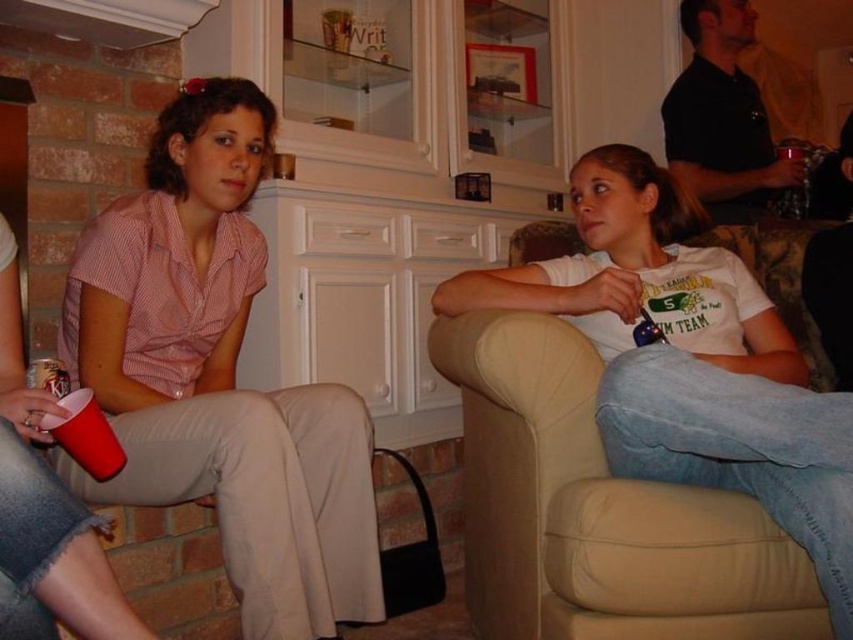
Question: Does pink cotton shirt at left appear over translucent glass cup at upper right?

Choices:
 (A) yes
 (B) no

Answer: (B)

Question: Which is farther from the pink cotton shirt at left?

Choices:
 (A) beige leather couch at center
 (B) translucent glass cup at upper right

Answer: (B)

Question: Is pink cotton shirt at left wider than beige leather couch at center?

Choices:
 (A) no
 (B) yes

Answer: (B)

Question: Which point is farther from the camera taking this photo?

Choices:
 (A) (509, 323)
 (B) (61, 324)

Answer: (B)

Question: Among these points, which one is nearest to the camera?

Choices:
 (A) (225, 349)
 (B) (807, 160)

Answer: (A)

Question: Considering the relative positions of pink cotton shirt at left and translucent glass cup at upper right in the image provided, where is pink cotton shirt at left located with respect to translucent glass cup at upper right?

Choices:
 (A) right
 (B) left

Answer: (B)